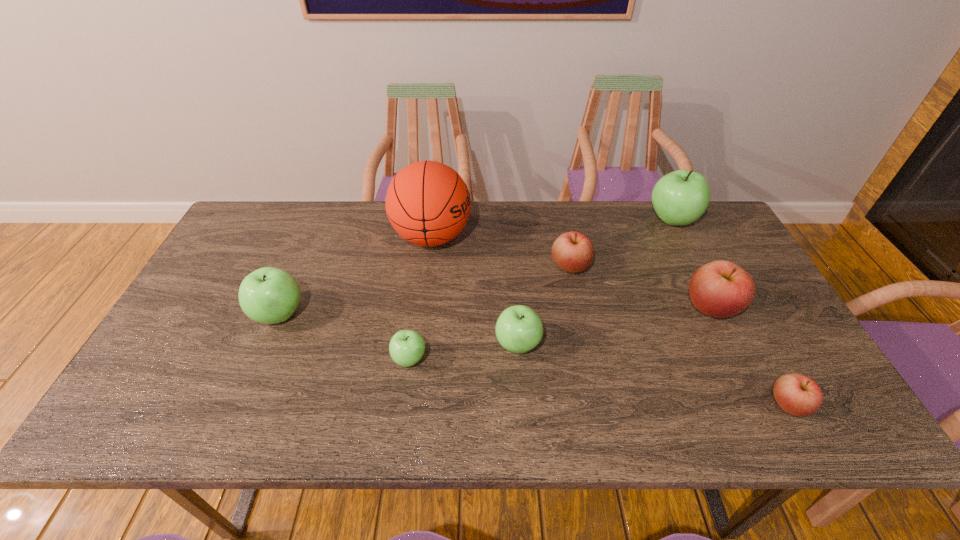
Locate an element on the screen. the tallest object is located at coordinates (428, 204).

Identify the location of the farthest apple. The image size is (960, 540). (679, 198).

Where is `the rightmost green apple`? The width and height of the screenshot is (960, 540). the rightmost green apple is located at coordinates (679, 198).

Find the location of a particular element. Image resolution: width=960 pixels, height=540 pixels. the second biggest green apple is located at coordinates (269, 295).

In order to click on the leftmost object in this screenshot , I will do `click(269, 295)`.

The height and width of the screenshot is (540, 960). Find the location of `the biggest red apple`. the biggest red apple is located at coordinates (720, 289).

Find the location of `the third apple from left to right`. the third apple from left to right is located at coordinates (519, 329).

Where is `the second green apple from right to left`? This screenshot has height=540, width=960. the second green apple from right to left is located at coordinates (519, 329).

Find the location of a particular element. the fourth apple from left to right is located at coordinates (573, 252).

The height and width of the screenshot is (540, 960). I want to click on the farthest red apple, so click(x=573, y=252).